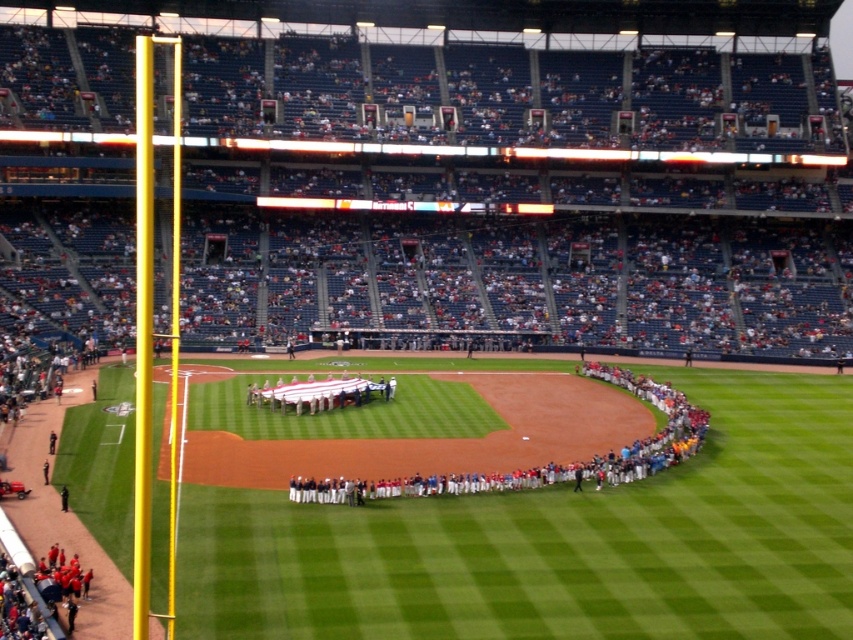
Question: Which point is farther from the camera taking this photo?

Choices:
 (A) (616, 381)
 (B) (251, 547)

Answer: (A)

Question: Is green grass field at center closer to camera compared to white uniformed players at center?

Choices:
 (A) yes
 (B) no

Answer: (A)

Question: Which of the following is the farthest from the observer?

Choices:
 (A) white uniformed players at center
 (B) green grass field at center

Answer: (A)

Question: Can you confirm if green grass field at center is thinner than white uniformed players at center?

Choices:
 (A) yes
 (B) no

Answer: (B)

Question: Which point is closer to the camera taking this photo?

Choices:
 (A) (276, 493)
 (B) (618, 376)

Answer: (A)

Question: Is green grass field at center above white uniformed players at center?

Choices:
 (A) no
 (B) yes

Answer: (A)